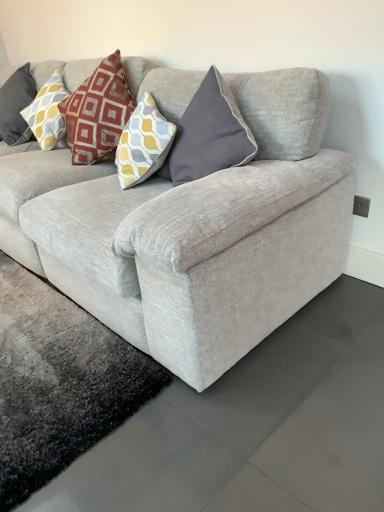
Question: Is matte yellow and gray diamond-patterned pillow at upper left to the left or to the right of textured gray couch at center in the image?

Choices:
 (A) left
 (B) right

Answer: (A)

Question: From a real-world perspective, relative to textured gray couch at center, is matte yellow and gray diamond-patterned pillow at upper left vertically above or below?

Choices:
 (A) below
 (B) above

Answer: (B)

Question: Is matte yellow and gray diamond-patterned pillow at upper left situated inside textured gray couch at center or outside?

Choices:
 (A) outside
 (B) inside

Answer: (B)

Question: Is textured gray couch at center taller or shorter than matte yellow and gray diamond-patterned pillow at upper left?

Choices:
 (A) short
 (B) tall

Answer: (B)

Question: Visually, is textured gray couch at center positioned to the left or to the right of matte yellow and gray diamond-patterned pillow at upper left?

Choices:
 (A) left
 (B) right

Answer: (B)

Question: Considering their positions, is textured gray couch at center located in front of or behind matte yellow and gray diamond-patterned pillow at upper left?

Choices:
 (A) behind
 (B) front

Answer: (B)

Question: Is point (334, 186) positioned closer to the camera than point (51, 96)?

Choices:
 (A) closer
 (B) farther

Answer: (A)